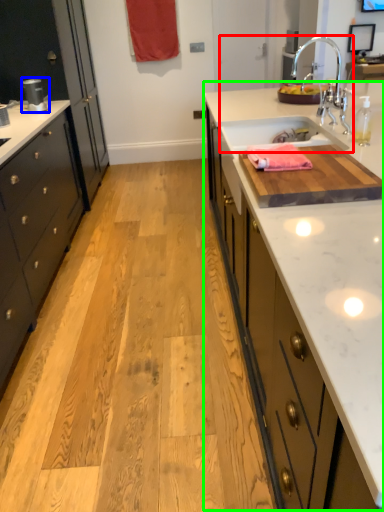
Question: Based on their relative distances, which object is nearer to sink (highlighted by a red box)? Choose from appliance (highlighted by a blue box) and countertop (highlighted by a green box).

Choices:
 (A) appliance
 (B) countertop

Answer: (B)